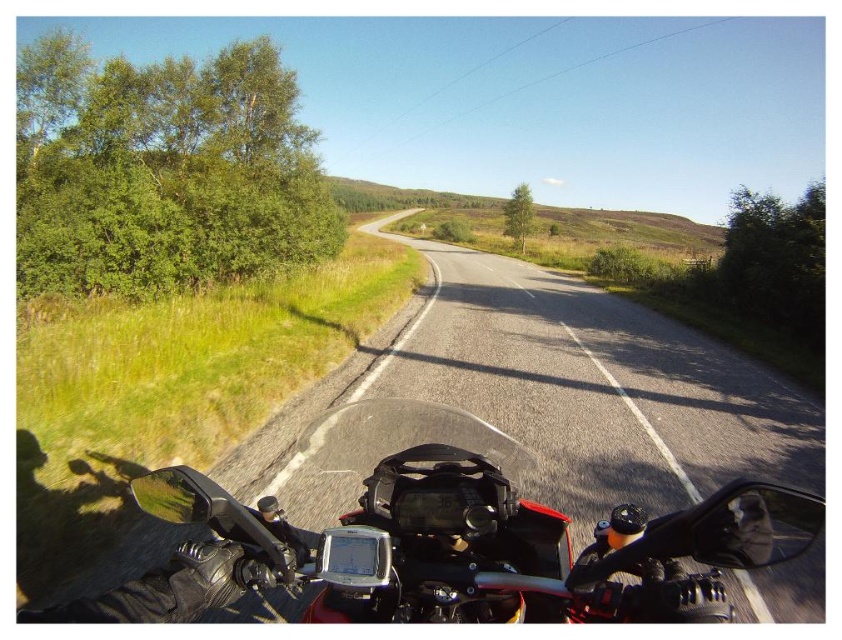
Can you confirm if shiny black motorcycle at center is smaller than black matte helmet at upper left?

Incorrect, shiny black motorcycle at center is not smaller in size than black matte helmet at upper left.

Between point (384, 472) and point (147, 609), which one is positioned behind?

Positioned behind is point (384, 472).

Who is more forward, (754, 563) or (217, 524)?

Point (754, 563) is more forward.

At what (x,y) coordinates should I click in order to perform the action: click on shiny black motorcycle at center. Please return your answer as a coordinate pair (x, y). Looking at the image, I should click on (451, 538).